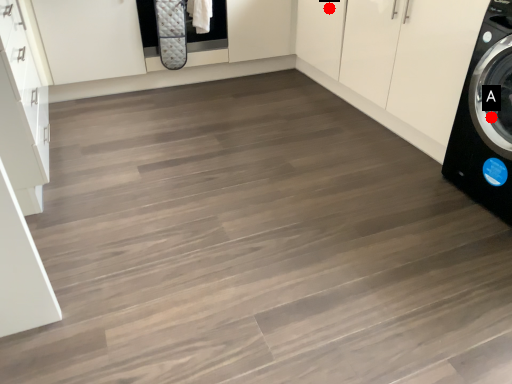
Question: Two points are circled on the image, labeled by A and B beside each circle. Which of the following is the farthest from the observer?

Choices:
 (A) A is further
 (B) B is further

Answer: (B)